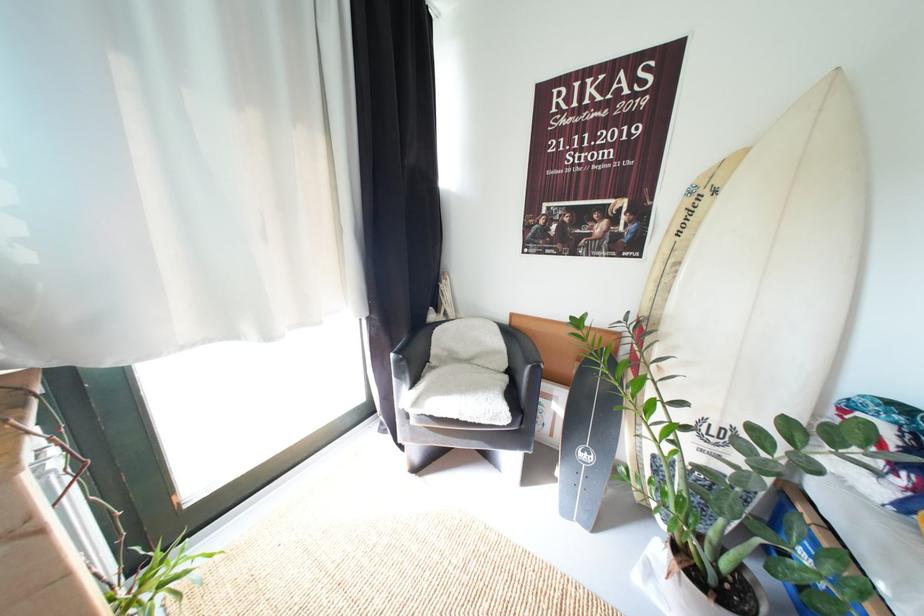
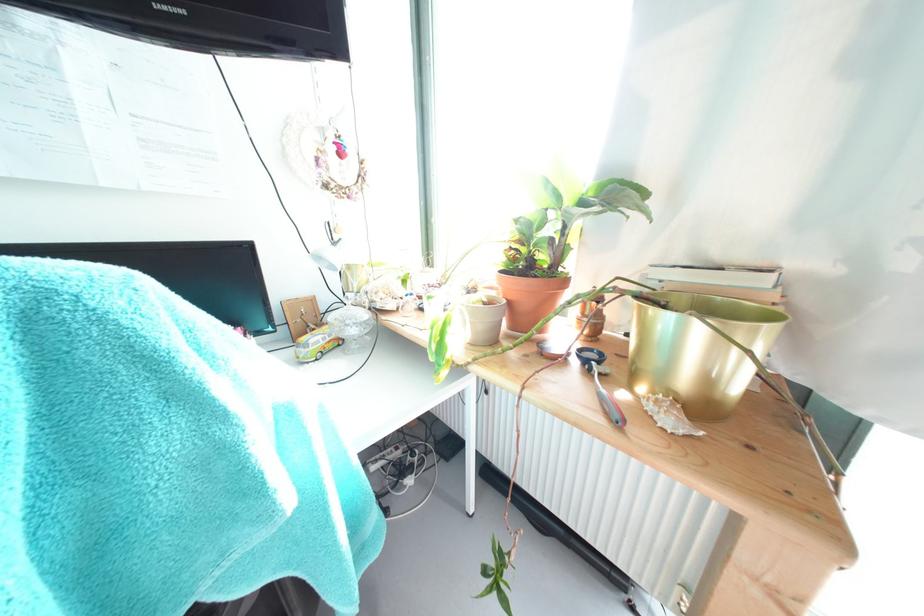
First-person continuous shooting, in which direction is the camera rotating?

The rotation direction of the camera is left-down.